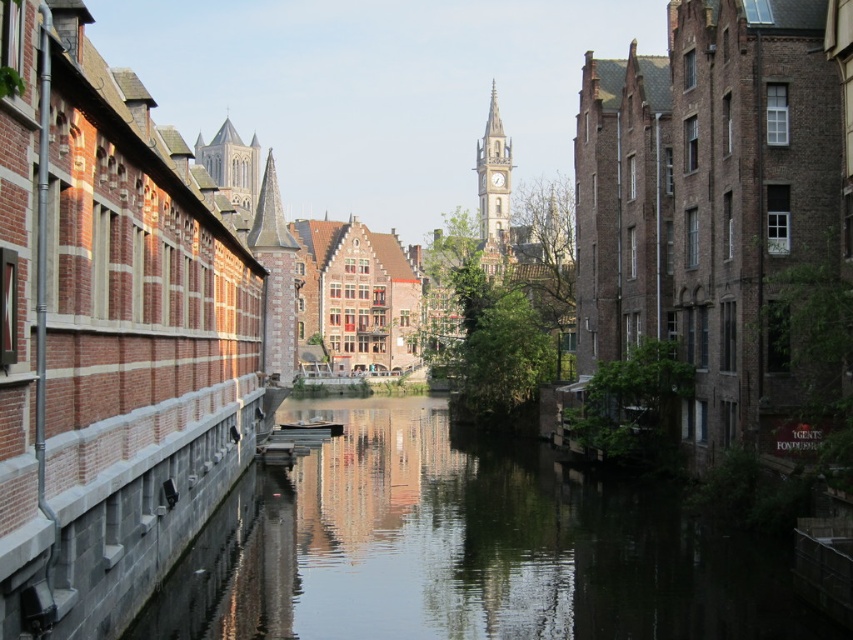
You are a tourist standing at the edge of the canal and want to take a photo of both the smooth concrete water at center and the smooth stone tower at upper center. Which object should you focus on first to ensure both are in the frame?

You should focus on the smooth stone tower at upper center first because it is behind the smooth concrete water at center, so adjusting the camera to include the tower will naturally include the water as well.

You are a tourist standing on the bridge overlooking the canal. You notice the smooth concrete water at center and the smooth stone tower at upper center. Which object appears narrower from your vantage point?

The smooth concrete water at center appears narrower than the smooth stone tower at upper center because it has a lesser width compared to the tower.

You are a tourist standing on the left bank of the canal. You want to take a photo that includes both the stone clock tower at center and the smooth stone tower at upper center. Based on their positions, which tower should you position to the left side of your camera frame to include both in the shot?

Since the stone clock tower at center is to the right of the smooth stone tower at upper center, you should position the smooth stone tower at upper center to the left side of your camera frame to include both in the shot.